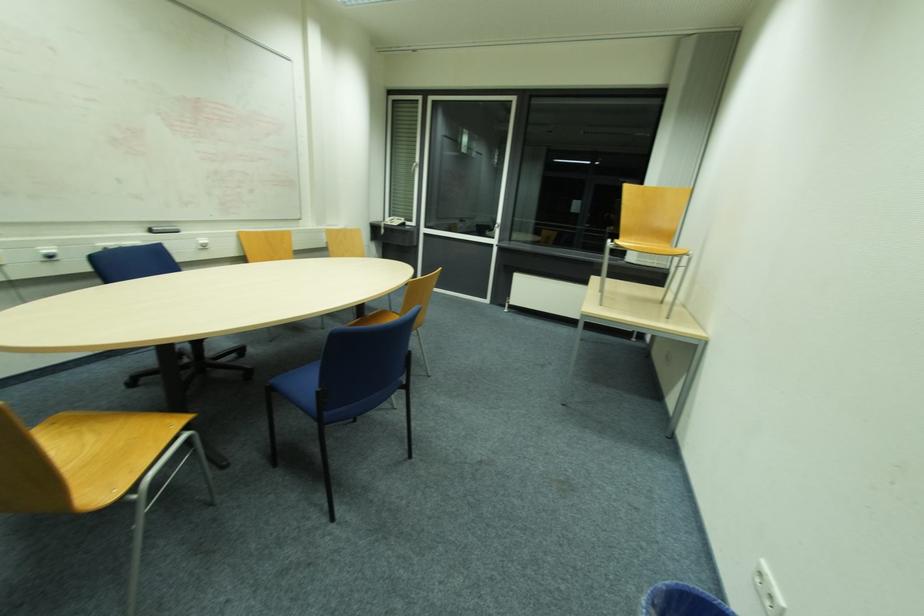
The width and height of the screenshot is (924, 616). I want to click on blue chair sitting surface, so click(308, 377).